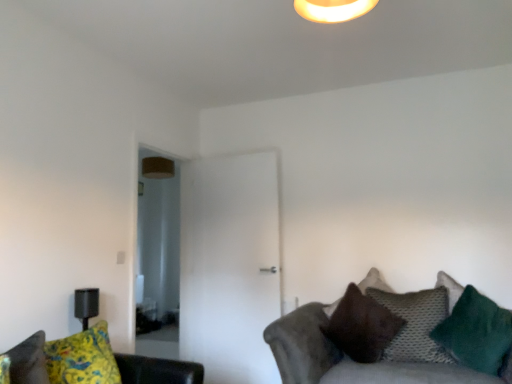
Identify the location of textured gray couch at lower right, the first studio couch viewed from the right. Image resolution: width=512 pixels, height=384 pixels. (345, 359).

Find the location of a particular element. The height and width of the screenshot is (384, 512). brown suede pillow at lower right, placed as the 3th pillow when sorted from front to back is located at coordinates (362, 326).

How much space does brown suede pillow at lower right, placed as the 3th pillow when sorted from front to back, occupy vertically?

25.19 inches.

Find the location of `yellow fabric couch at lower left, marked as the 2th studio couch in a right-to-left arrangement`. yellow fabric couch at lower left, marked as the 2th studio couch in a right-to-left arrangement is located at coordinates (157, 370).

In order to click on textured gray couch at lower right, which is the second studio couch in left-to-right order in this screenshot , I will do `click(345, 359)`.

From the image's perspective, is knitted gray pillow at lower right, acting as the second pillow starting from the front, on top of yellow fabric couch at lower left, marked as the 2th studio couch in a right-to-left arrangement?

Actually, knitted gray pillow at lower right, acting as the second pillow starting from the front, appears below yellow fabric couch at lower left, marked as the 2th studio couch in a right-to-left arrangement, in the image.

From a real-world perspective, which is physically below, knitted gray pillow at lower right, which appears as the second pillow when viewed from the back, or yellow fabric couch at lower left, which is the first studio couch in left-to-right order?

In real-world perspective, knitted gray pillow at lower right, which appears as the second pillow when viewed from the back, is lower.

Could you tell me if knitted gray pillow at lower right, which appears as the second pillow when viewed from the back, is facing yellow fabric couch at lower left, marked as the 2th studio couch in a right-to-left arrangement?

No.

From a real-world perspective, is brown suede pillow at lower right, placed as the 3th pillow when sorted from front to back, under green fuzzy pillow at right, the 1th pillow viewed from the front?

No, from a real-world perspective, brown suede pillow at lower right, placed as the 3th pillow when sorted from front to back, is not beneath green fuzzy pillow at right, the 1th pillow viewed from the front.

Which is more distant, (369,307) or (476,359)?

The point (369,307) is farther from the camera.

Which is in front, brown suede pillow at lower right, placed as the 3th pillow when sorted from front to back, or green fuzzy pillow at right, acting as the third pillow starting from the back?

green fuzzy pillow at right, acting as the third pillow starting from the back, is in front.

Considering the relative sizes of brown suede pillow at lower right, which is counted as the 1th pillow, starting from the back, and green fuzzy pillow at right, acting as the third pillow starting from the back, in the image provided, is brown suede pillow at lower right, which is counted as the 1th pillow, starting from the back, smaller than green fuzzy pillow at right, acting as the third pillow starting from the back,?

Actually, brown suede pillow at lower right, which is counted as the 1th pillow, starting from the back, might be larger than green fuzzy pillow at right, acting as the third pillow starting from the back.

In the scene shown: How many degrees apart are the facing directions of yellow fabric couch at lower left, which is the first studio couch in left-to-right order, and textured gray couch at lower right, the first studio couch viewed from the right?

The angle between the facing direction of yellow fabric couch at lower left, which is the first studio couch in left-to-right order, and the facing direction of textured gray couch at lower right, the first studio couch viewed from the right, is 74.8 degrees.

Between yellow fabric couch at lower left, which is the first studio couch in left-to-right order, and textured gray couch at lower right, the first studio couch viewed from the right, which one is positioned in front?

yellow fabric couch at lower left, which is the first studio couch in left-to-right order.

Is yellow fabric couch at lower left, marked as the 2th studio couch in a right-to-left arrangement, oriented away from textured gray couch at lower right, which is the second studio couch in left-to-right order?

No, yellow fabric couch at lower left, marked as the 2th studio couch in a right-to-left arrangement, is not facing the opposite direction of textured gray couch at lower right, which is the second studio couch in left-to-right order.

Can you confirm if yellow fabric couch at lower left, marked as the 2th studio couch in a right-to-left arrangement, is thinner than textured gray couch at lower right, the first studio couch viewed from the right?

Indeed, yellow fabric couch at lower left, marked as the 2th studio couch in a right-to-left arrangement, has a lesser width compared to textured gray couch at lower right, the first studio couch viewed from the right.

Who is shorter, yellow fabric couch at lower left, marked as the 2th studio couch in a right-to-left arrangement, or brown suede pillow at lower right, which is counted as the 1th pillow, starting from the back?

yellow fabric couch at lower left, marked as the 2th studio couch in a right-to-left arrangement.

Is yellow fabric couch at lower left, which is the first studio couch in left-to-right order, turned away from brown suede pillow at lower right, placed as the 3th pillow when sorted from front to back?

No, brown suede pillow at lower right, placed as the 3th pillow when sorted from front to back, is not at the back of yellow fabric couch at lower left, which is the first studio couch in left-to-right order.

Are yellow fabric couch at lower left, marked as the 2th studio couch in a right-to-left arrangement, and brown suede pillow at lower right, placed as the 3th pillow when sorted from front to back, making contact?

yellow fabric couch at lower left, marked as the 2th studio couch in a right-to-left arrangement, and brown suede pillow at lower right, placed as the 3th pillow when sorted from front to back, are clearly separated.

Considering the relative sizes of yellow fabric couch at lower left, which is the first studio couch in left-to-right order, and brown suede pillow at lower right, placed as the 3th pillow when sorted from front to back, in the image provided, is yellow fabric couch at lower left, which is the first studio couch in left-to-right order, thinner than brown suede pillow at lower right, placed as the 3th pillow when sorted from front to back,?

Indeed, yellow fabric couch at lower left, which is the first studio couch in left-to-right order, has a lesser width compared to brown suede pillow at lower right, placed as the 3th pillow when sorted from front to back.

Would you say textured gray couch at lower right, the first studio couch viewed from the right, is part of brown suede pillow at lower right, placed as the 3th pillow when sorted from front to back,'s contents?

That's incorrect, textured gray couch at lower right, the first studio couch viewed from the right, is not inside brown suede pillow at lower right, placed as the 3th pillow when sorted from front to back.

Is brown suede pillow at lower right, which is counted as the 1th pillow, starting from the back, in front of or behind textured gray couch at lower right, the first studio couch viewed from the right, in the image?

Clearly, brown suede pillow at lower right, which is counted as the 1th pillow, starting from the back, is behind textured gray couch at lower right, the first studio couch viewed from the right.

Which pillow is the 3rd one when counting from the back of the textured gray couch at lower right, which is the second studio couch in left-to-right order? Please provide its 2D coordinates.

[(362, 326)]

In terms of width, does brown suede pillow at lower right, which is counted as the 1th pillow, starting from the back, look wider or thinner when compared to textured gray couch at lower right, which is the second studio couch in left-to-right order?

brown suede pillow at lower right, which is counted as the 1th pillow, starting from the back, is thinner than textured gray couch at lower right, which is the second studio couch in left-to-right order.

Does textured gray couch at lower right, the first studio couch viewed from the right, appear on the left side of knitted gray pillow at lower right, acting as the second pillow starting from the front?

Yes.

From a real-world perspective, is textured gray couch at lower right, which is the second studio couch in left-to-right order, physically located above or below knitted gray pillow at lower right, acting as the second pillow starting from the front?

textured gray couch at lower right, which is the second studio couch in left-to-right order, is below knitted gray pillow at lower right, acting as the second pillow starting from the front.

Is textured gray couch at lower right, which is the second studio couch in left-to-right order, not near knitted gray pillow at lower right, which appears as the second pillow when viewed from the back?

Actually, textured gray couch at lower right, which is the second studio couch in left-to-right order, and knitted gray pillow at lower right, which appears as the second pillow when viewed from the back, are a little close together.

From the image's perspective, which object appears higher, textured gray couch at lower right, the first studio couch viewed from the right, or knitted gray pillow at lower right, which appears as the second pillow when viewed from the back?

knitted gray pillow at lower right, which appears as the second pillow when viewed from the back.

Image resolution: width=512 pixels, height=384 pixels. Identify the location of the 3rd pillow above when counting from the textured gray couch at lower right, the first studio couch viewed from the right (from the image's perspective). (476, 333).

From a real-world perspective, does green fuzzy pillow at right, the 1th pillow viewed from the front, sit lower than textured gray couch at lower right, which is the second studio couch in left-to-right order?

No, from a real-world perspective, green fuzzy pillow at right, the 1th pillow viewed from the front, is not below textured gray couch at lower right, which is the second studio couch in left-to-right order.

At what (x,y) coordinates should I click in order to perform the action: click on the 2nd pillow behind when counting from the yellow fabric couch at lower left, which is the first studio couch in left-to-right order. Please return your answer as a coordinate pair (x, y). Looking at the image, I should click on (415, 324).

From the brown suede pillow at lower right, which is counted as the 1th pillow, starting from the back, count 2nd pillow to the right and point to it. Please provide its 2D coordinates.

[(476, 333)]

Looking at the image, which one is located closer to yellow fabric couch at lower left, which is the first studio couch in left-to-right order, knitted gray pillow at lower right, acting as the second pillow starting from the front, or brown suede pillow at lower right, placed as the 3th pillow when sorted from front to back?

brown suede pillow at lower right, placed as the 3th pillow when sorted from front to back, lies closer to yellow fabric couch at lower left, which is the first studio couch in left-to-right order, than the other object.

Based on their spatial positions, is knitted gray pillow at lower right, which appears as the second pillow when viewed from the back, or yellow fabric couch at lower left, marked as the 2th studio couch in a right-to-left arrangement, closer to green fuzzy pillow at right, the 1th pillow viewed from the front?

knitted gray pillow at lower right, which appears as the second pillow when viewed from the back, is positioned closer to the anchor green fuzzy pillow at right, the 1th pillow viewed from the front.

In the scene shown: Looking at the image, which one is located further to yellow fabric couch at lower left, marked as the 2th studio couch in a right-to-left arrangement, textured gray couch at lower right, the first studio couch viewed from the right, or knitted gray pillow at lower right, which appears as the second pillow when viewed from the back?

The object further to yellow fabric couch at lower left, marked as the 2th studio couch in a right-to-left arrangement, is knitted gray pillow at lower right, which appears as the second pillow when viewed from the back.

Considering their positions, is knitted gray pillow at lower right, which appears as the second pillow when viewed from the back, positioned closer to brown suede pillow at lower right, which is counted as the 1th pillow, starting from the back, than yellow fabric couch at lower left, which is the first studio couch in left-to-right order?

knitted gray pillow at lower right, which appears as the second pillow when viewed from the back.

When comparing their distances from yellow fabric couch at lower left, which is the first studio couch in left-to-right order, does knitted gray pillow at lower right, which appears as the second pillow when viewed from the back, or green fuzzy pillow at right, acting as the third pillow starting from the back, seem closer?

knitted gray pillow at lower right, which appears as the second pillow when viewed from the back, is closer to yellow fabric couch at lower left, which is the first studio couch in left-to-right order.

Which object lies further to the anchor point green fuzzy pillow at right, the 1th pillow viewed from the front, knitted gray pillow at lower right, acting as the second pillow starting from the front, or brown suede pillow at lower right, placed as the 3th pillow when sorted from front to back?

brown suede pillow at lower right, placed as the 3th pillow when sorted from front to back, is positioned further to the anchor green fuzzy pillow at right, the 1th pillow viewed from the front.

Which object lies further to the anchor point green fuzzy pillow at right, acting as the third pillow starting from the back, brown suede pillow at lower right, placed as the 3th pillow when sorted from front to back, or textured gray couch at lower right, the first studio couch viewed from the right?

Among the two, brown suede pillow at lower right, placed as the 3th pillow when sorted from front to back, is located further to green fuzzy pillow at right, acting as the third pillow starting from the back.

Looking at the image, which one is located further to yellow fabric couch at lower left, which is the first studio couch in left-to-right order, brown suede pillow at lower right, placed as the 3th pillow when sorted from front to back, or green fuzzy pillow at right, acting as the third pillow starting from the back?

The object further to yellow fabric couch at lower left, which is the first studio couch in left-to-right order, is green fuzzy pillow at right, acting as the third pillow starting from the back.

You are a GUI agent. You are given a task and a screenshot of the screen. Output one action in this format:
    pyautogui.click(x=<x>, y=<y>)
    Task: Click on the pillow positioned between textured gray couch at lower right, the first studio couch viewed from the right, and knitted gray pillow at lower right, acting as the second pillow starting from the front, from near to far
    Image resolution: width=512 pixels, height=384 pixels.
    Given the screenshot: What is the action you would take?
    pos(476,333)

The width and height of the screenshot is (512, 384). Identify the location of pillow between yellow fabric couch at lower left, which is the first studio couch in left-to-right order, and knitted gray pillow at lower right, which appears as the second pillow when viewed from the back, in the horizontal direction. (362, 326).

I want to click on pillow between green fuzzy pillow at right, the 1th pillow viewed from the front, and brown suede pillow at lower right, placed as the 3th pillow when sorted from front to back, along the z-axis, so click(x=415, y=324).

Identify the location of studio couch situated between yellow fabric couch at lower left, which is the first studio couch in left-to-right order, and knitted gray pillow at lower right, which appears as the second pillow when viewed from the back, from left to right. Image resolution: width=512 pixels, height=384 pixels. (345, 359).